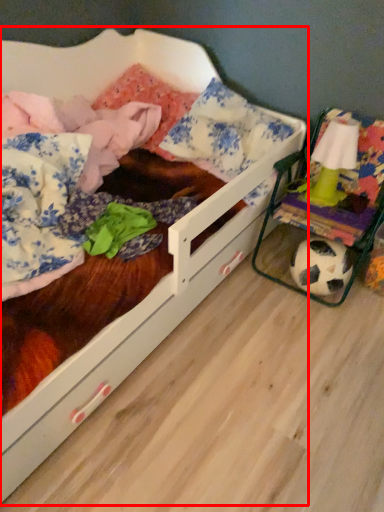
Question: From the image's perspective, where is infant bed (annotated by the red box) located in relation to toy in the image?

Choices:
 (A) below
 (B) above

Answer: (A)